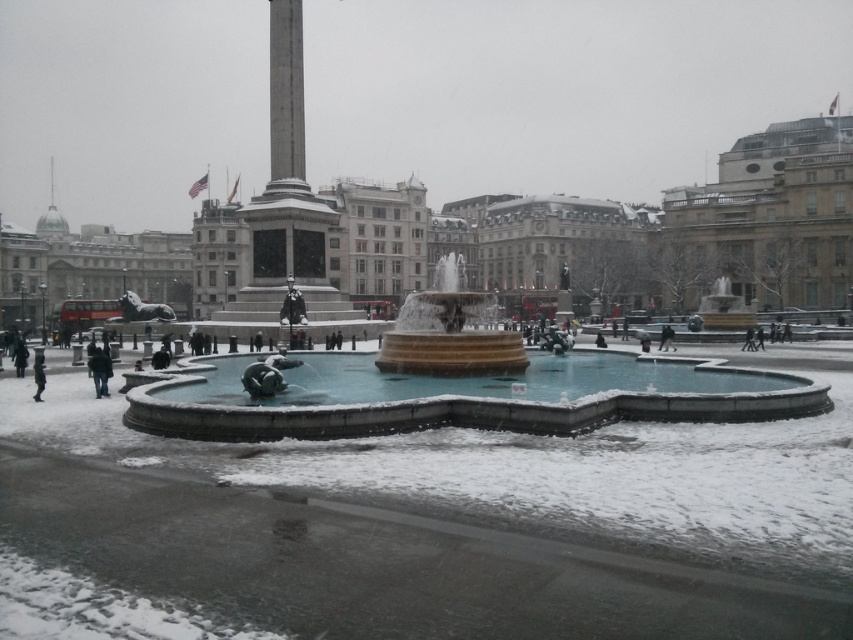
Does polished stone obelisk at center have a greater height compared to yellow stone fountain at center?

Indeed, polished stone obelisk at center has a greater height compared to yellow stone fountain at center.

Is polished stone obelisk at center thinner than yellow stone fountain at center?

In fact, polished stone obelisk at center might be wider than yellow stone fountain at center.

Does point (334, 307) come closer to viewer compared to point (447, 324)?

No, it is not.

You are a GUI agent. You are given a task and a screenshot of the screen. Output one action in this format:
    pyautogui.click(x=<x>, y=<y>)
    Task: Click on the polished stone obelisk at center
    
    Given the screenshot: What is the action you would take?
    pyautogui.click(x=286, y=196)

Who is more forward, (241, 406) or (666, 330)?

Point (241, 406) is more forward.

Based on the photo, can you confirm if gold stone fountain at center is shorter than black leather jacket at lower center?

No, gold stone fountain at center is not shorter than black leather jacket at lower center.

Locate an element on the screen. Image resolution: width=853 pixels, height=640 pixels. gold stone fountain at center is located at coordinates (457, 396).

Is polished stone obelisk at center bigger than dark gray fabric jacket at lower left?

Correct, polished stone obelisk at center is larger in size than dark gray fabric jacket at lower left.

Which is in front, point (299, 125) or point (33, 358)?

Point (33, 358) is in front.

Image resolution: width=853 pixels, height=640 pixels. I want to click on polished stone obelisk at center, so click(x=286, y=196).